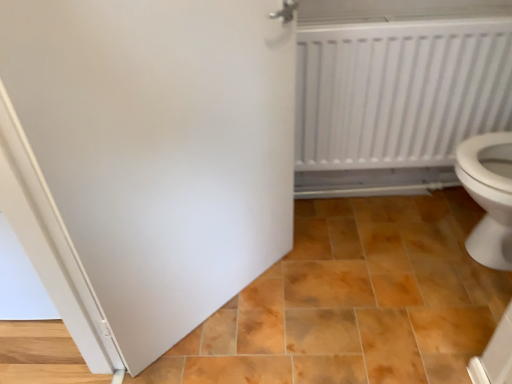
Question: Can you confirm if white matte door at center is positioned to the right of white plastic radiator at upper right?

Choices:
 (A) no
 (B) yes

Answer: (A)

Question: From a real-world perspective, is white matte door at center located beneath white plastic radiator at upper right?

Choices:
 (A) yes
 (B) no

Answer: (B)

Question: From the image's perspective, is white matte door at center above white plastic radiator at upper right?

Choices:
 (A) no
 (B) yes

Answer: (A)

Question: Is white matte door at center oriented away from white plastic radiator at upper right?

Choices:
 (A) yes
 (B) no

Answer: (B)

Question: Is white matte door at center wider than white plastic radiator at upper right?

Choices:
 (A) no
 (B) yes

Answer: (A)

Question: Does point (199, 281) appear closer or farther from the camera than point (468, 130)?

Choices:
 (A) closer
 (B) farther

Answer: (A)

Question: Considering the positions of white matte door at center and white plastic radiator at upper right in the image, is white matte door at center bigger or smaller than white plastic radiator at upper right?

Choices:
 (A) small
 (B) big

Answer: (B)

Question: Is white matte door at center taller or shorter than white plastic radiator at upper right?

Choices:
 (A) short
 (B) tall

Answer: (B)

Question: Considering the positions of white matte door at center and white plastic radiator at upper right in the image, is white matte door at center wider or thinner than white plastic radiator at upper right?

Choices:
 (A) wide
 (B) thin

Answer: (B)

Question: Looking at the image, does white plastic radiator at upper right seem bigger or smaller compared to white matte door at center?

Choices:
 (A) big
 (B) small

Answer: (B)

Question: In terms of width, does white plastic radiator at upper right look wider or thinner when compared to white matte door at center?

Choices:
 (A) thin
 (B) wide

Answer: (B)

Question: Is white plastic radiator at upper right situated inside white matte door at center or outside?

Choices:
 (A) outside
 (B) inside

Answer: (A)

Question: Is point (351, 160) closer or farther from the camera than point (79, 314)?

Choices:
 (A) closer
 (B) farther

Answer: (B)

Question: Considering their positions, is brown glossy tile at center located in front of or behind white matte door at center?

Choices:
 (A) behind
 (B) front

Answer: (A)

Question: Based on their sizes in the image, would you say brown glossy tile at center is bigger or smaller than white matte door at center?

Choices:
 (A) small
 (B) big

Answer: (B)